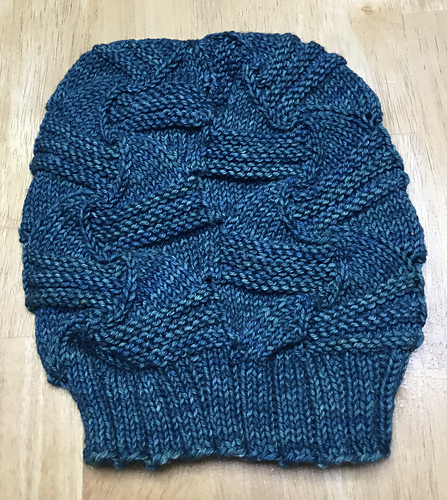
Find the location of `corners`. corners is located at coordinates (10, 488), (436, 490), (429, 12), (11, 23).